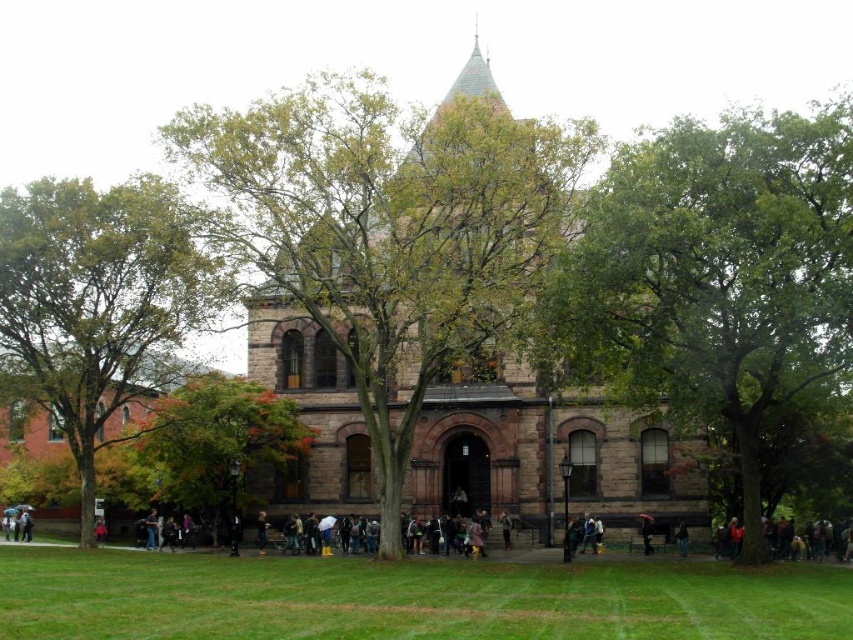
Does brown stone church at center have a lesser height compared to blue jeans at lower right?

No, brown stone church at center is not shorter than blue jeans at lower right.

Is brown stone church at center to the left of blue jeans at lower right from the viewer's perspective?

Correct, you'll find brown stone church at center to the left of blue jeans at lower right.

The image size is (853, 640). I want to click on brown stone church at center, so click(x=546, y=452).

Can you confirm if green leafy tree at lower left is taller than autumn leaves at lower left?

Correct, green leafy tree at lower left is much taller as autumn leaves at lower left.

Who is lower down, green leafy tree at lower left or autumn leaves at lower left?

autumn leaves at lower left is lower down.

Does point (175, 330) come farther from viewer compared to point (289, 406)?

Yes, point (175, 330) is behind point (289, 406).

You are a GUI agent. You are given a task and a screenshot of the screen. Output one action in this format:
    pyautogui.click(x=<x>, y=<y>)
    Task: Click on the green leafy tree at lower left
    
    Given the screenshot: What is the action you would take?
    pyautogui.click(x=97, y=305)

In the scene shown: Who is more forward, [650,552] or [679,544]?

Point [679,544]

Is raincoat fabric umbrella at lower center smaller than blue jeans at lower right?

Yes, raincoat fabric umbrella at lower center is smaller than blue jeans at lower right.

I want to click on raincoat fabric umbrella at lower center, so click(646, 532).

Where is `raincoat fabric umbrella at lower center`? The width and height of the screenshot is (853, 640). raincoat fabric umbrella at lower center is located at coordinates (646, 532).